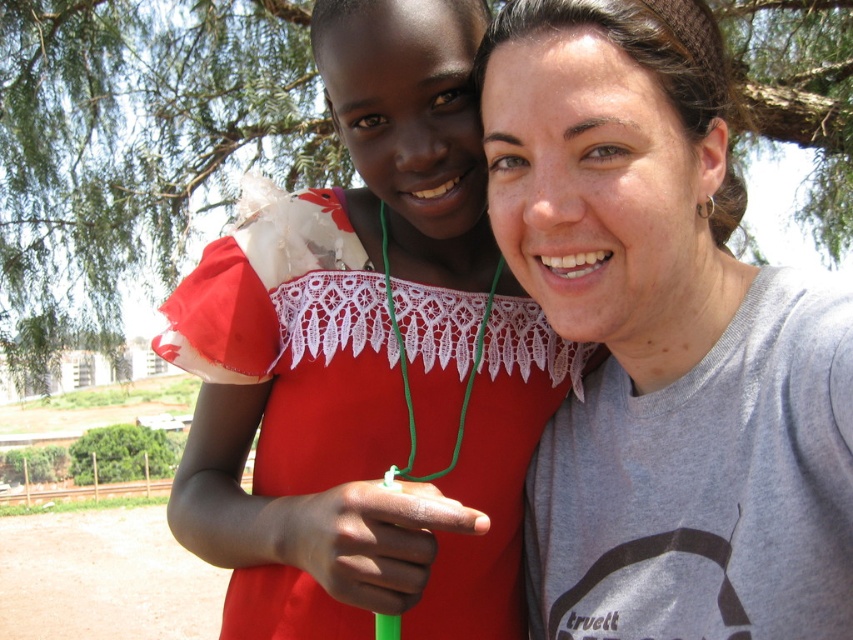
Question: Is gray cotton t-shirt at center positioned behind matte red dress at center?

Choices:
 (A) no
 (B) yes

Answer: (A)

Question: Is gray cotton t-shirt at center below green leafy tree at upper center?

Choices:
 (A) no
 (B) yes

Answer: (B)

Question: Which of the following is the farthest from the observer?

Choices:
 (A) (596, 93)
 (B) (74, 122)
 (C) (239, 241)

Answer: (B)

Question: Estimate the real-world distances between objects in this image. Which object is closer to the matte red dress at center?

Choices:
 (A) gray cotton t-shirt at center
 (B) green leafy tree at upper center

Answer: (A)

Question: Is gray cotton t-shirt at center smaller than matte red dress at center?

Choices:
 (A) yes
 (B) no

Answer: (A)

Question: Which point is farther to the camera?

Choices:
 (A) gray cotton t-shirt at center
 (B) green leafy tree at upper center

Answer: (B)